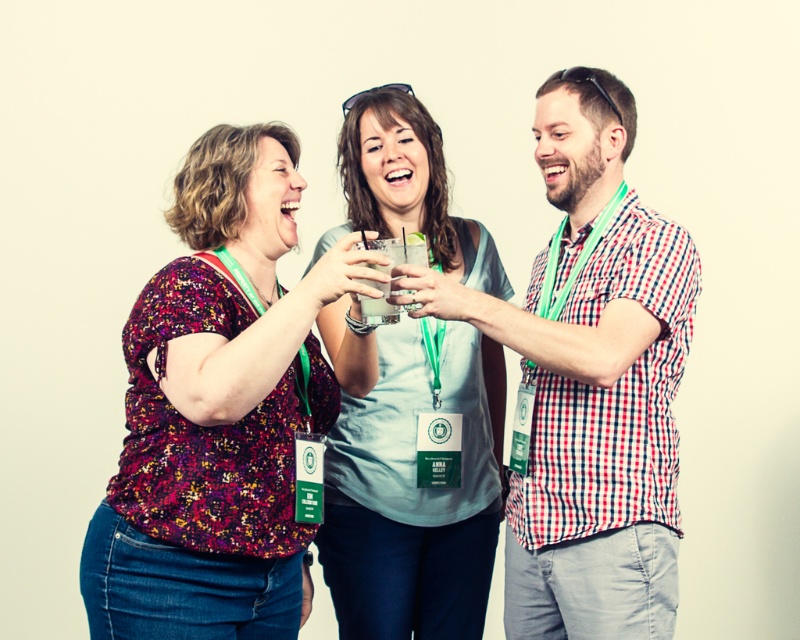
Locate an element on the screen. checkered cotton shirt at center is located at coordinates (596, 433).

Where is `checkered cotton shirt at center`? The width and height of the screenshot is (800, 640). checkered cotton shirt at center is located at coordinates (x=596, y=433).

At what (x,y) coordinates should I click in order to perform the action: click on checkered cotton shirt at center. Please return your answer as a coordinate pair (x, y). The image size is (800, 640). Looking at the image, I should click on (596, 433).

Is floral print blouse at center positioned in front of light blue cotton shirt at center?

Yes, it is.

Does floral print blouse at center have a larger size compared to light blue cotton shirt at center?

Incorrect, floral print blouse at center is not larger than light blue cotton shirt at center.

The height and width of the screenshot is (640, 800). I want to click on floral print blouse at center, so click(x=218, y=410).

Is checkered cotton shirt at center to the left of light blue cotton shirt at center from the viewer's perspective?

Incorrect, checkered cotton shirt at center is not on the left side of light blue cotton shirt at center.

Is checkered cotton shirt at center positioned behind light blue cotton shirt at center?

No, it is in front of light blue cotton shirt at center.

Which is behind, point (508, 621) or point (440, 426)?

Positioned behind is point (440, 426).

Image resolution: width=800 pixels, height=640 pixels. In order to click on checkered cotton shirt at center in this screenshot , I will do `click(596, 433)`.